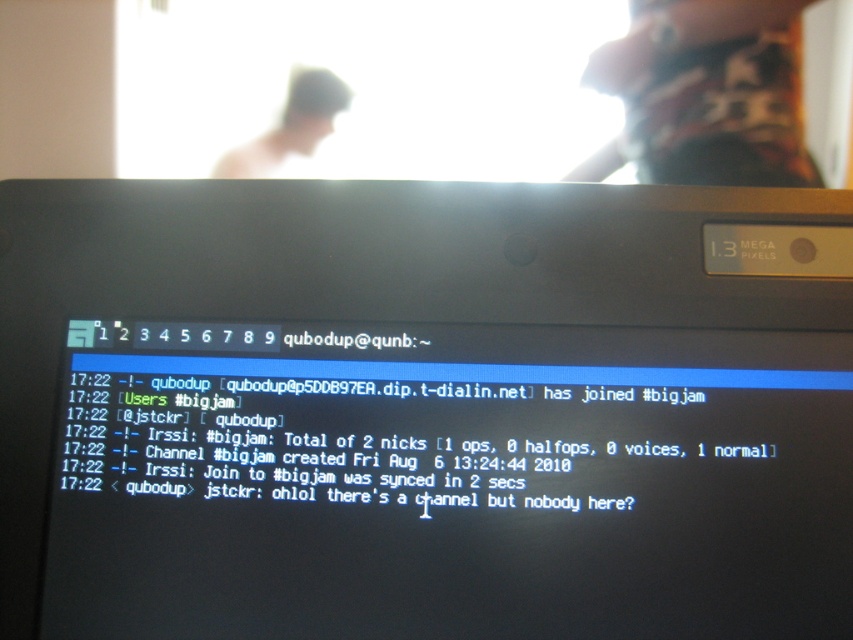
Question: Which of the following is the farthest from the observer?

Choices:
 (A) (772, 115)
 (B) (245, 148)

Answer: (B)

Question: Can you confirm if dark red fabric shirt at upper right is positioned to the right of blurred skin head at upper center?

Choices:
 (A) yes
 (B) no

Answer: (A)

Question: Which point is farther to the camera?

Choices:
 (A) dark red fabric shirt at upper right
 (B) black glossy laptop at center

Answer: (A)

Question: Can you confirm if dark red fabric shirt at upper right is positioned below blurred skin head at upper center?

Choices:
 (A) yes
 (B) no

Answer: (B)

Question: Which object is farther from the camera taking this photo?

Choices:
 (A) blurred skin head at upper center
 (B) black glossy laptop at center
 (C) dark red fabric shirt at upper right

Answer: (A)

Question: Observing the image, what is the correct spatial positioning of black glossy laptop at center in reference to blurred skin head at upper center?

Choices:
 (A) above
 (B) below

Answer: (B)